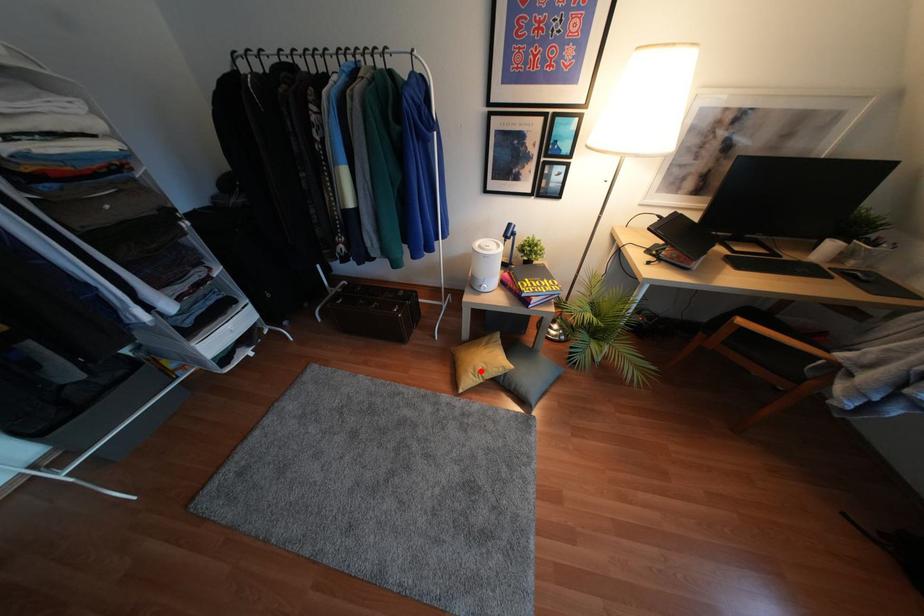
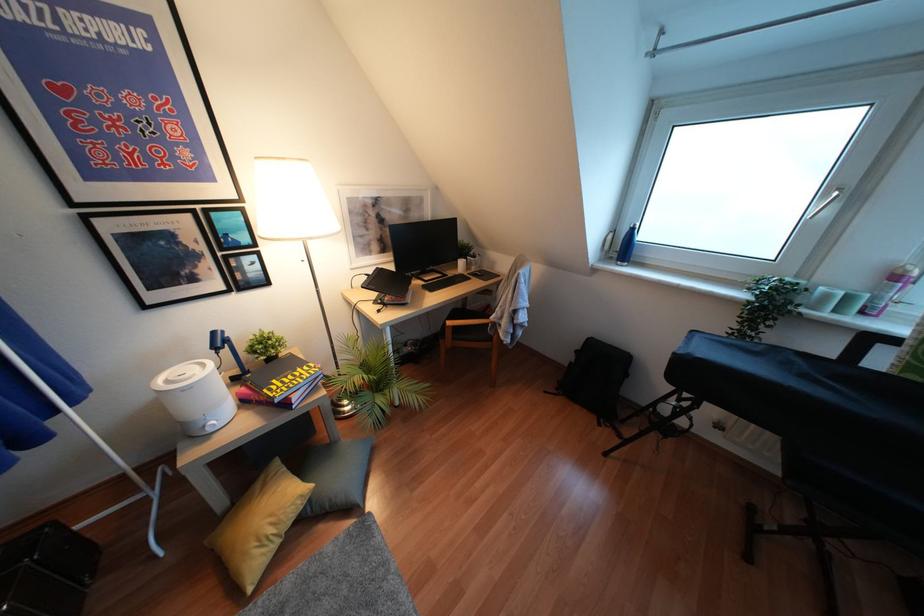
Question: A red point is marked in image1. In image2, is the corresponding 3D point closer to the camera or farther? Reply with the corresponding letter.

Choices:
 (A) The corresponding 3D point is closer.
 (B) The corresponding 3D point is farther.

Answer: (A)